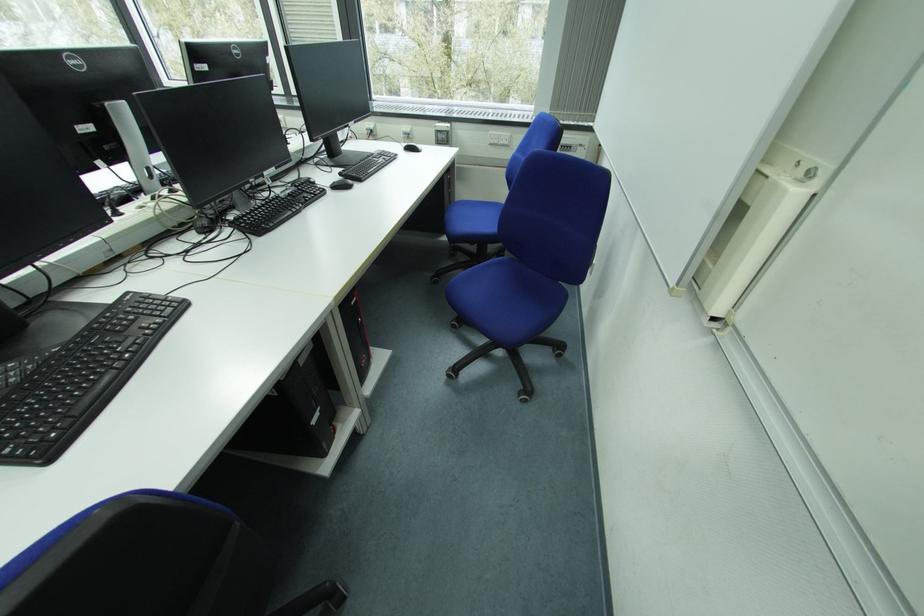
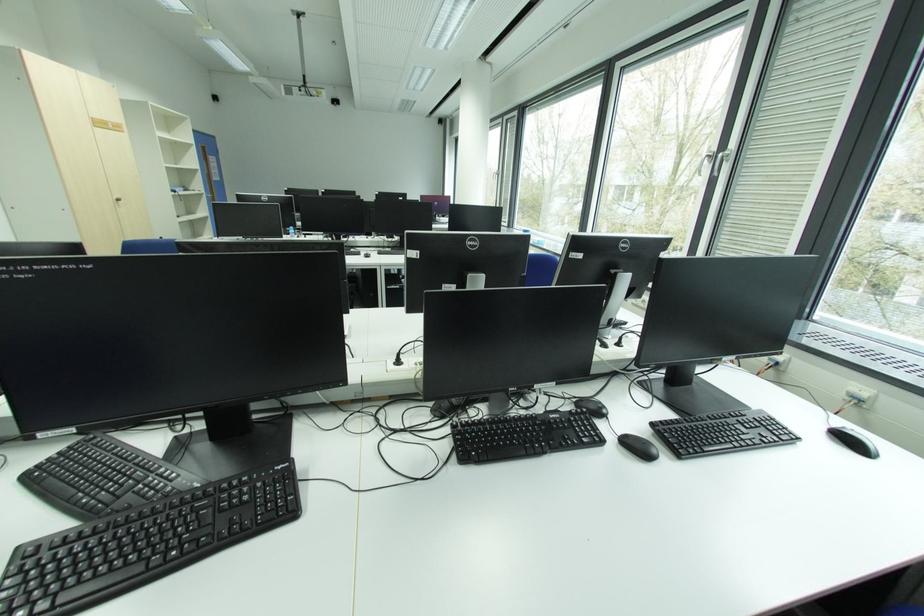
Question: Based on the continuous images, in which direction is the camera rotating? Reply with the corresponding letter.

Choices:
 (A) Left
 (B) Right
 (C) Up
 (D) Down

Answer: (A)